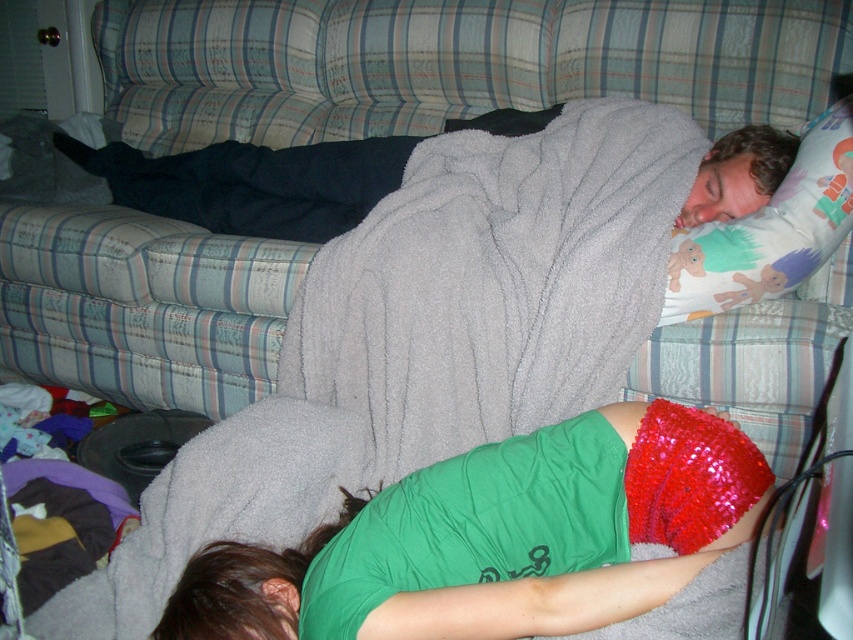
You are a photographer setting up a shoot in this living room. You need to place a small prop that is 10 cm tall. The prop must be placed on either the green fabric shorts at lower center or the white fabric pillow at upper right. Which surface can accommodate the prop without it falling off due to height constraints?

The white fabric pillow at upper right has a greater height than the green fabric shorts at lower center, so placing the prop on the white fabric pillow at upper right would be more stable as it can support the 10 cm tall prop better.

You are standing in a room with a plaid couch and two people resting. You see a point marked at coordinates (482, 529). Which object from the scene is located at this point?

The point at coordinates (482, 529) corresponds to the green fabric shorts at lower center.